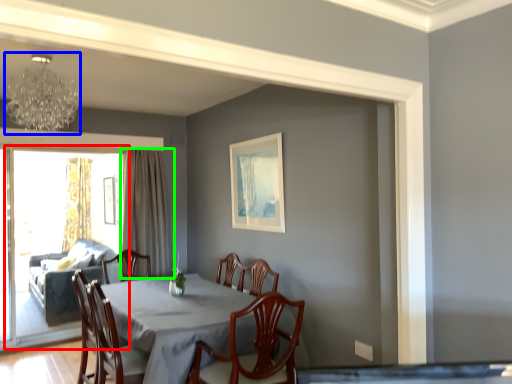
Question: Which object is the farthest from screen door (highlighted by a red box)? Choose among these: lamp (highlighted by a blue box) or curtain (highlighted by a green box).

Choices:
 (A) lamp
 (B) curtain

Answer: (A)